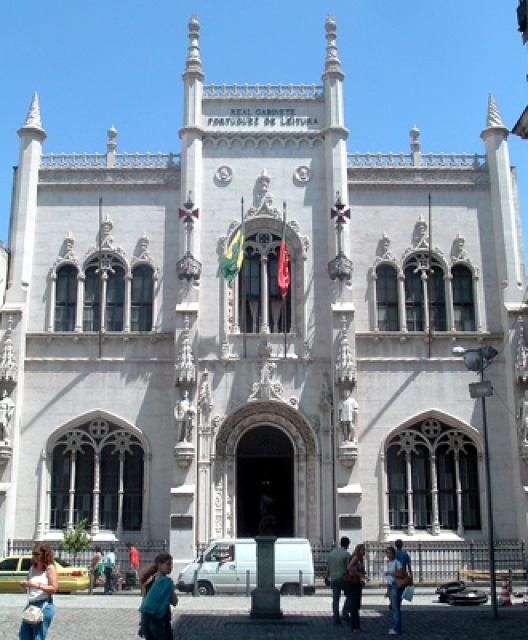
You are standing in front of the Real Gabinete Portuguesso de Leitura building. There is a point marked at coordinates point (39, 595). What object is located at this point?

The point (39, 595) corresponds to the denim jeans at lower left.

You are a photographer standing in front of the Real Gabinete Portuguesso de Leitura in Lisbon. You want to capture a photo of the building while including both the denim jeans at lower left and the green fabric bag at lower center in the frame. Which object should you focus on to ensure both are in the frame without zooming in or out?

You should focus on the denim jeans at lower left because it is larger in size than the green fabric bag at lower center, so keeping it in frame will naturally include the smaller green fabric bag at lower center as well.

You are standing in front of the Real Gabinete Portuguesso de Leitura building and notice two items on the ground near the entrance. The denim jeans at lower left and the teal fabric jacket at lower center. Which item is positioned higher up relative to the other?

The denim jeans at lower left is above the teal fabric jacket at lower center, so the denim jeans at lower left is positioned higher up.